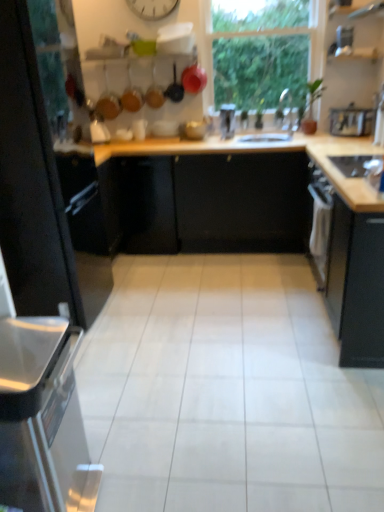
Image resolution: width=384 pixels, height=512 pixels. In order to click on free space above metallic silver toaster at upper right, the 1th appliance positioned from the top (from a real-world perspective) in this screenshot , I will do `click(338, 15)`.